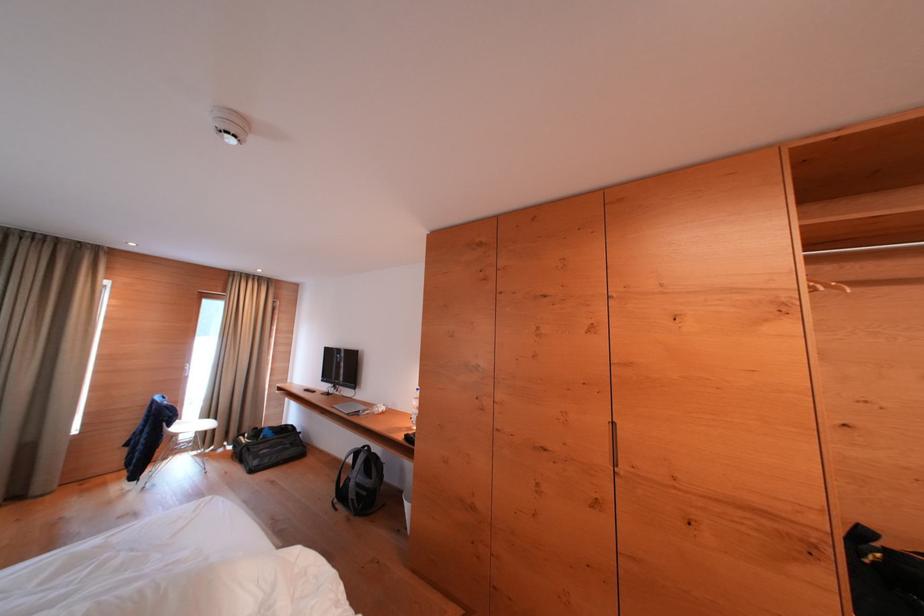
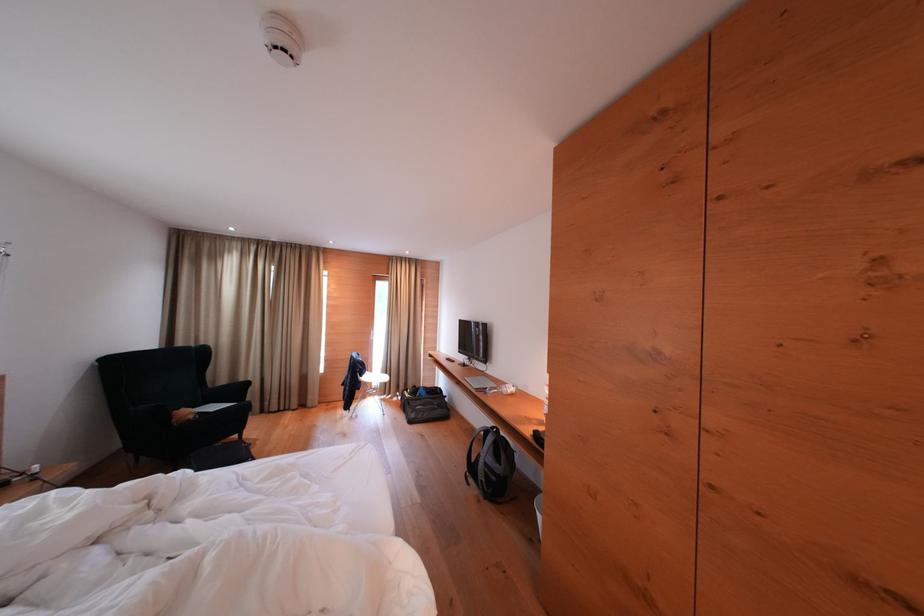
The point at (363, 458) is marked in the first image. Where is the corresponding point in the second image?

(493, 437)